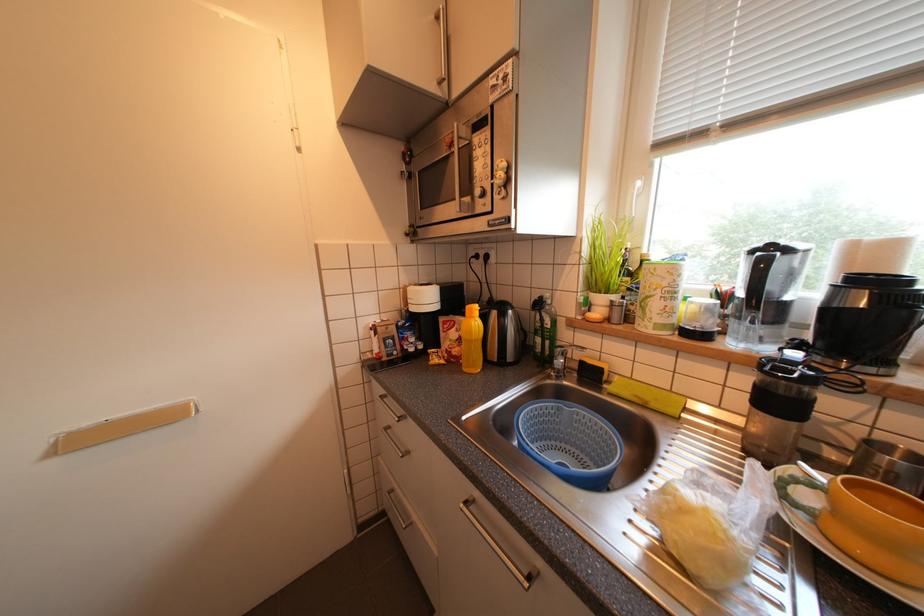
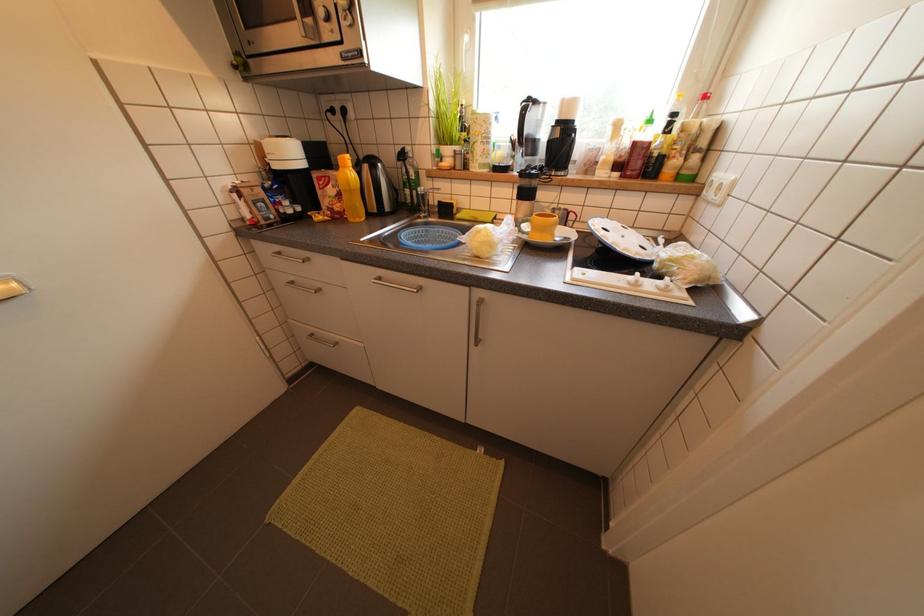
The images are taken continuously from a first-person perspective. In which direction is your viewpoint rotating?

The rotation direction of the camera is right-down.